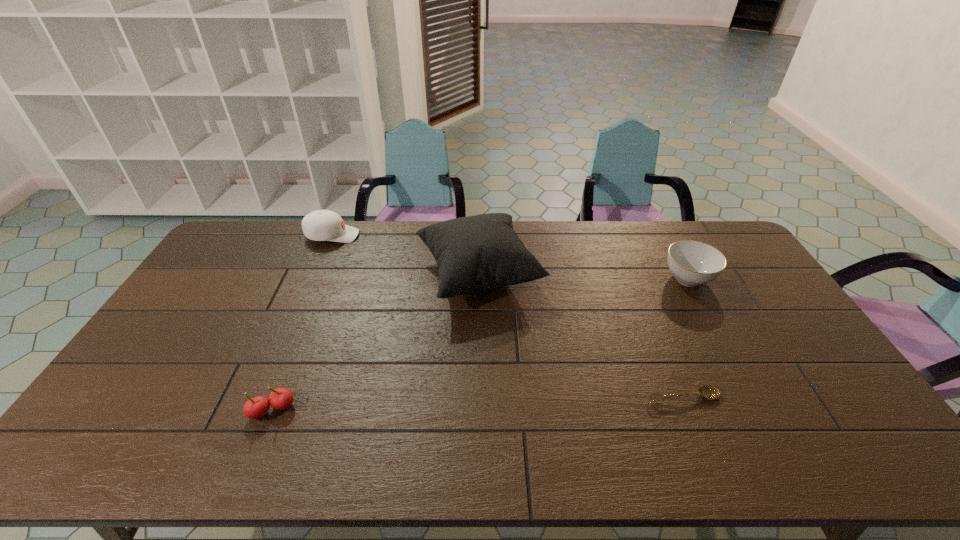
You are a GUI agent. You are given a task and a screenshot of the screen. Output one action in this format:
    pyautogui.click(x=<x>, y=<y>)
    Task: Click on the cushion
    
    Given the screenshot: What is the action you would take?
    pyautogui.click(x=476, y=253)

Locate an element on the screen. The image size is (960, 540). the third object from right to left is located at coordinates (476, 253).

The image size is (960, 540). Find the location of `baseball cap`. baseball cap is located at coordinates (322, 225).

Locate an element on the screen. The height and width of the screenshot is (540, 960). chinaware is located at coordinates (692, 263).

Find the location of a particular element. Image resolution: width=960 pixels, height=540 pixels. cherry is located at coordinates (281, 398).

Where is `the shortest object`? the shortest object is located at coordinates (710, 392).

At what (x,y) coordinates should I click in order to perform the action: click on vacant region located on the front of the tallest object. Please return your answer as a coordinate pair (x, y). Image resolution: width=960 pixels, height=540 pixels. Looking at the image, I should click on (478, 414).

The width and height of the screenshot is (960, 540). Find the location of `free space located on the front-facing side of the baseball cap`. free space located on the front-facing side of the baseball cap is located at coordinates (379, 235).

The image size is (960, 540). I want to click on vacant area situated 0.310m on the left of the chinaware, so click(x=571, y=279).

The image size is (960, 540). Find the location of `vacant area located 0.190m on the left of the cherry`. vacant area located 0.190m on the left of the cherry is located at coordinates (176, 410).